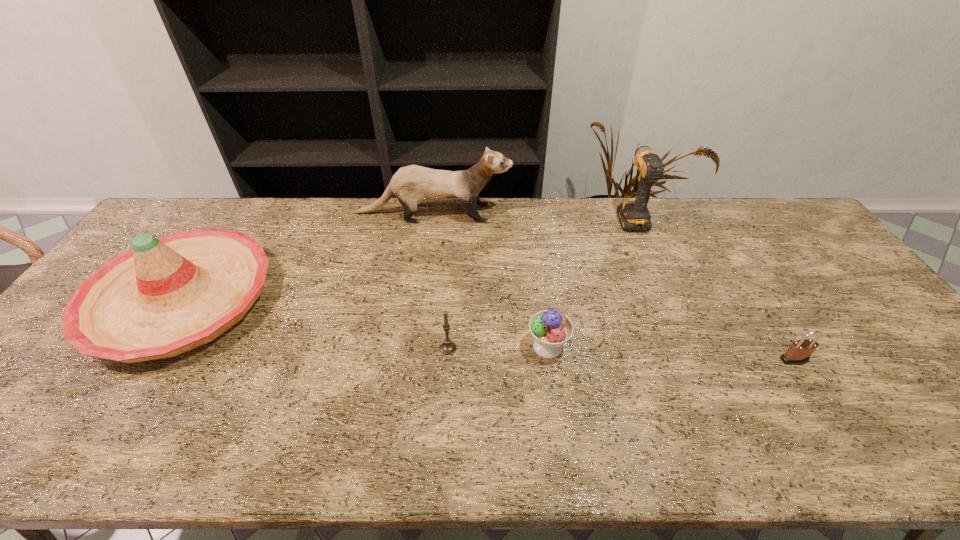
Where is `object that can be found as the second closest to the drill`? The height and width of the screenshot is (540, 960). object that can be found as the second closest to the drill is located at coordinates (551, 329).

Locate an element on the screen. The image size is (960, 540). the third closest object relative to the fifth object from left to right is located at coordinates (799, 352).

Where is `blank area in the image that satisfies the following two spatial constraints: 1. on the face of the ferret; 2. on the front side of the sombrero`? The image size is (960, 540). blank area in the image that satisfies the following two spatial constraints: 1. on the face of the ferret; 2. on the front side of the sombrero is located at coordinates (421, 300).

You are a GUI agent. You are given a task and a screenshot of the screen. Output one action in this format:
    pyautogui.click(x=<x>, y=<y>)
    Task: Click on the blank space that satisfies the following two spatial constraints: 1. on the face of the ferret; 2. with the drill bit of the drill facing forward
    
    Given the screenshot: What is the action you would take?
    [433, 216]

Find the location of a particular element. This screenshot has height=540, width=960. vacant space that satisfies the following two spatial constraints: 1. on the face of the ferret; 2. on the right side of the fourth object from left to right is located at coordinates (416, 347).

The height and width of the screenshot is (540, 960). What are the coordinates of `vacant space that satisfies the following two spatial constraints: 1. on the back side of the fourth object from left to right; 2. on the left side of the candle` in the screenshot? It's located at (448, 347).

You are a GUI agent. You are given a task and a screenshot of the screen. Output one action in this format:
    pyautogui.click(x=<x>, y=<y>)
    Task: Click on the vacant space that satisfies the following two spatial constraints: 1. on the front side of the leftmost object; 2. on the right side of the icecream
    Image resolution: width=960 pixels, height=540 pixels.
    Given the screenshot: What is the action you would take?
    pyautogui.click(x=151, y=347)

The image size is (960, 540). What are the coordinates of `free space that satisfies the following two spatial constraints: 1. on the face of the ferret; 2. on the back side of the padlock` in the screenshot? It's located at (414, 359).

Find the location of a particular element. Image resolution: width=960 pixels, height=540 pixels. vacant space that satisfies the following two spatial constraints: 1. on the face of the icecream; 2. on the left side of the ferret is located at coordinates (416, 347).